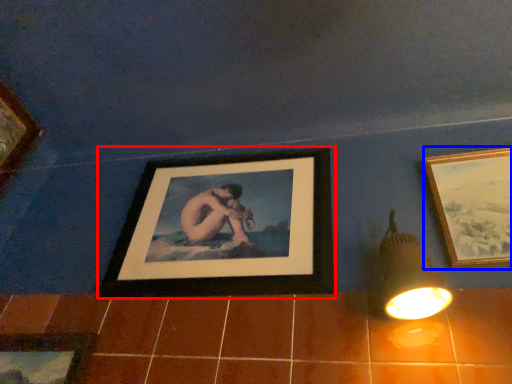
Question: Which object appears closest to the camera in this image, picture frame (highlighted by a red box) or picture frame (highlighted by a blue box)?

Choices:
 (A) picture frame
 (B) picture frame

Answer: (B)